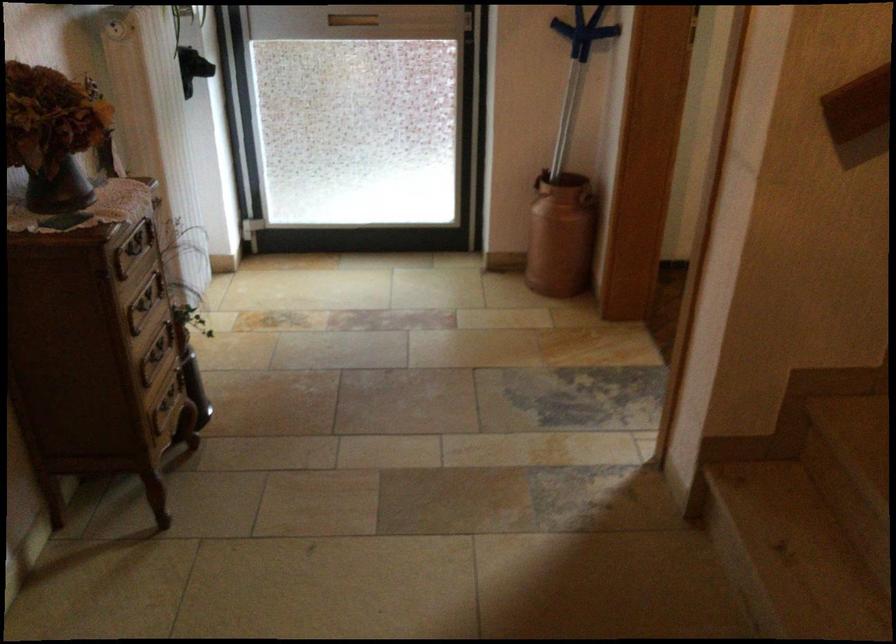
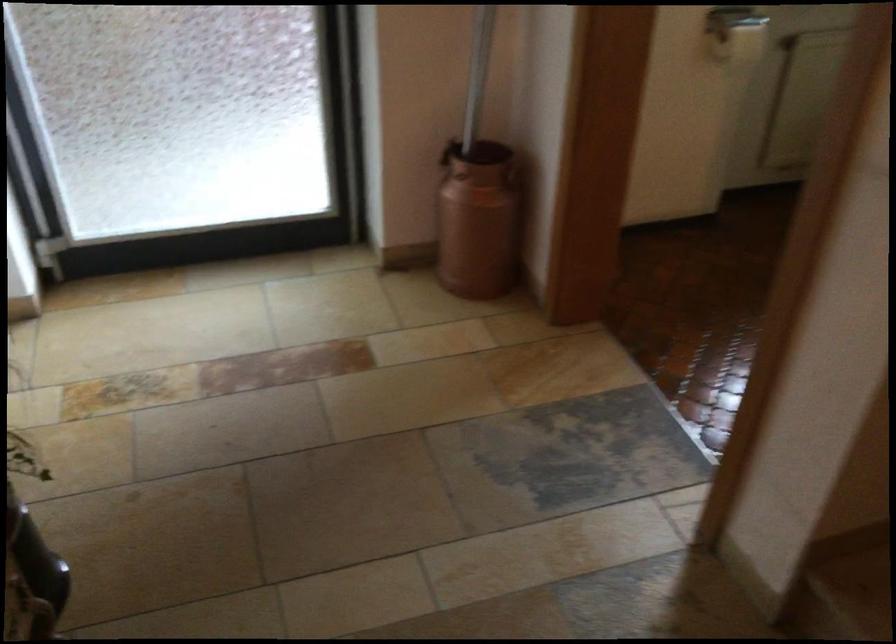
Question: The first image is from the beginning of the video and the second image is from the end. How did the camera likely rotate when shooting the video?

Choices:
 (A) Left
 (B) Right
 (C) Up
 (D) Down

Answer: (B)